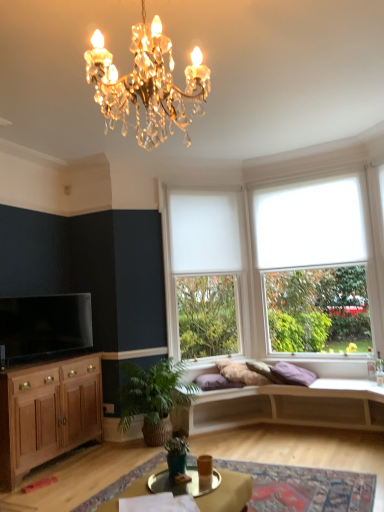
Question: Is green matte plant at lower center, acting as the second houseplant starting from the back, wider or thinner than green leafy plant at lower center, positioned as the second houseplant in front-to-back order?

Choices:
 (A) thin
 (B) wide

Answer: (A)

Question: Is point (178, 450) positioned closer to the camera than point (167, 416)?

Choices:
 (A) farther
 (B) closer

Answer: (B)

Question: Considering the real-world distances, which object is closest to the white roller blind at right, the 2th window when ordered from left to right?

Choices:
 (A) white matte studio couch at center
 (B) metallic silver cocktail table at center
 (C) purple cotton pillow at center
 (D) white roller blind at right
 (E) wooden cabinet at lower left

Answer: (D)

Question: Which of these objects is positioned closest to the green matte plant at lower center, marked as the first houseplant in a front-to-back arrangement?

Choices:
 (A) purple cotton pillow at center
 (B) white matte blind at upper center
 (C) white roller blind at center, which appears as the first window when viewed from the left
 (D) green leafy plant at lower center, positioned as the second houseplant in front-to-back order
 (E) white roller blind at right

Answer: (D)